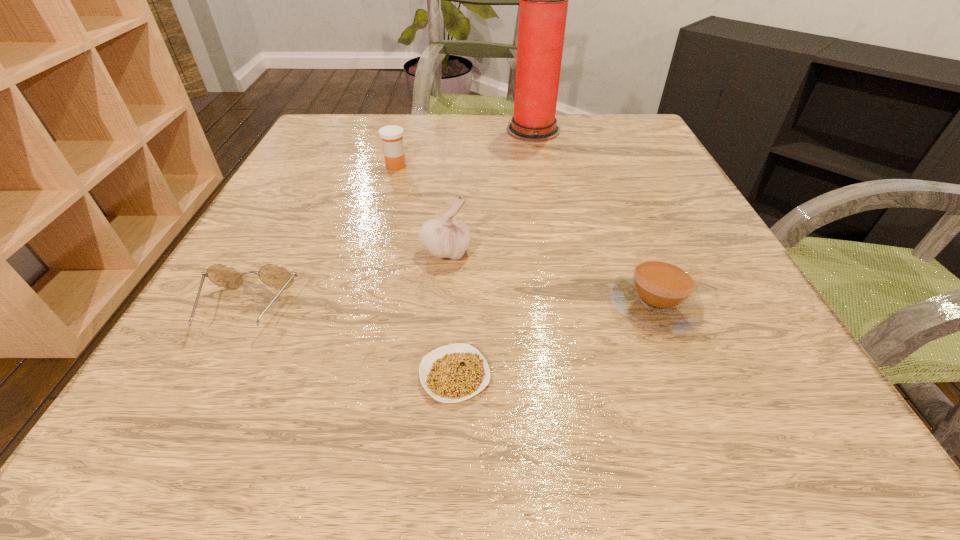
Find the location of a particular element. The width and height of the screenshot is (960, 540). vacant space that satisfies the following two spatial constraints: 1. on the label of the medicine; 2. on the back side of the nearest object is located at coordinates (337, 375).

In order to click on vacant space that satisfies the following two spatial constraints: 1. on the front-facing side of the shortest object; 2. on the left side of the spectacles in this screenshot , I will do `click(211, 375)`.

At what (x,y) coordinates should I click in order to perform the action: click on free location that satisfies the following two spatial constraints: 1. on the label of the medicine; 2. on the front-facing side of the leftmost object. Please return your answer as a coordinate pair (x, y). This screenshot has height=540, width=960. Looking at the image, I should click on tap(355, 310).

Where is `vacant area that satisfies the following two spatial constraints: 1. on the label of the medicine; 2. on the left side of the cappuccino`? The height and width of the screenshot is (540, 960). vacant area that satisfies the following two spatial constraints: 1. on the label of the medicine; 2. on the left side of the cappuccino is located at coordinates (357, 305).